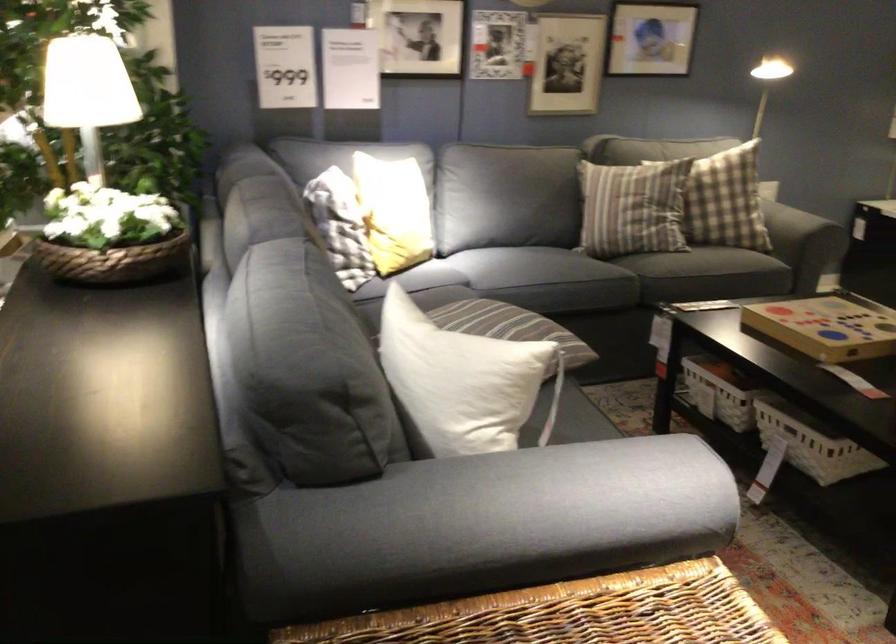
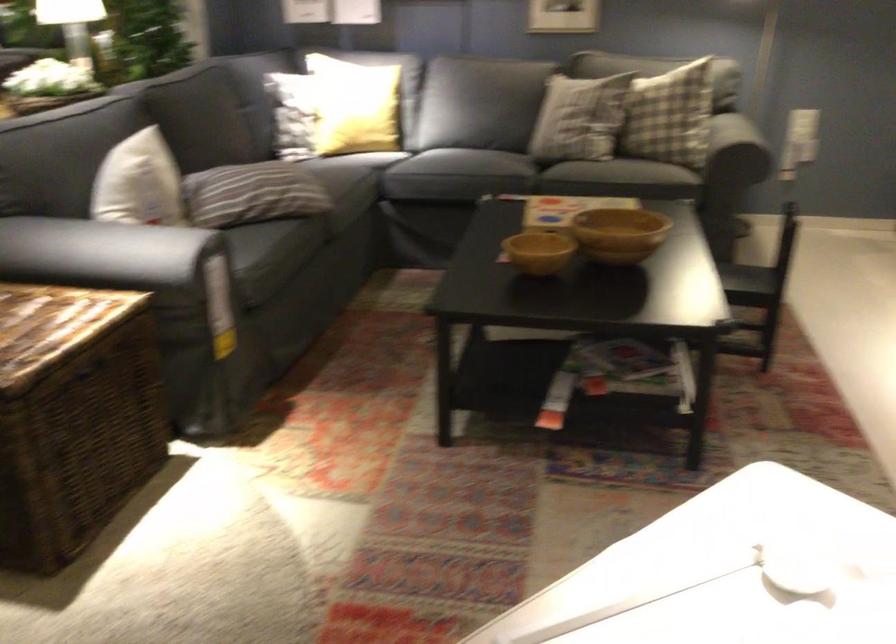
Where in the second image is the point corresponding to (x=563, y=476) from the first image?

(117, 252)